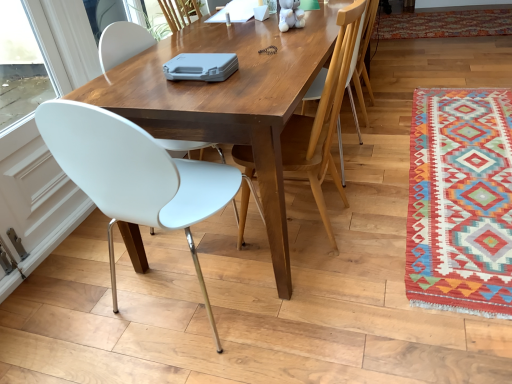
Identify the location of vacant space in front of white plastic chair at center, placed as the second chair when sorted from left to right. Image resolution: width=512 pixels, height=384 pixels. (332, 295).